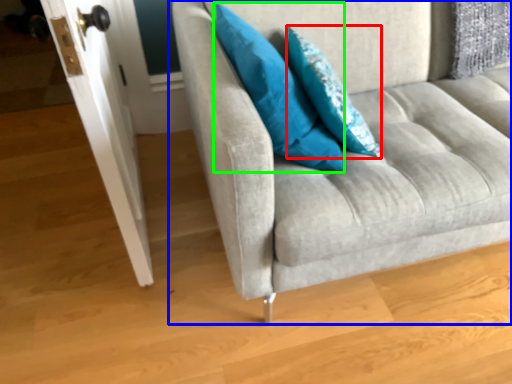
Question: Considering the real-world distances, which object is farthest from pillow (highlighted by a red box)? studio couch (highlighted by a blue box) or pillow (highlighted by a green box)?

Choices:
 (A) studio couch
 (B) pillow

Answer: (A)